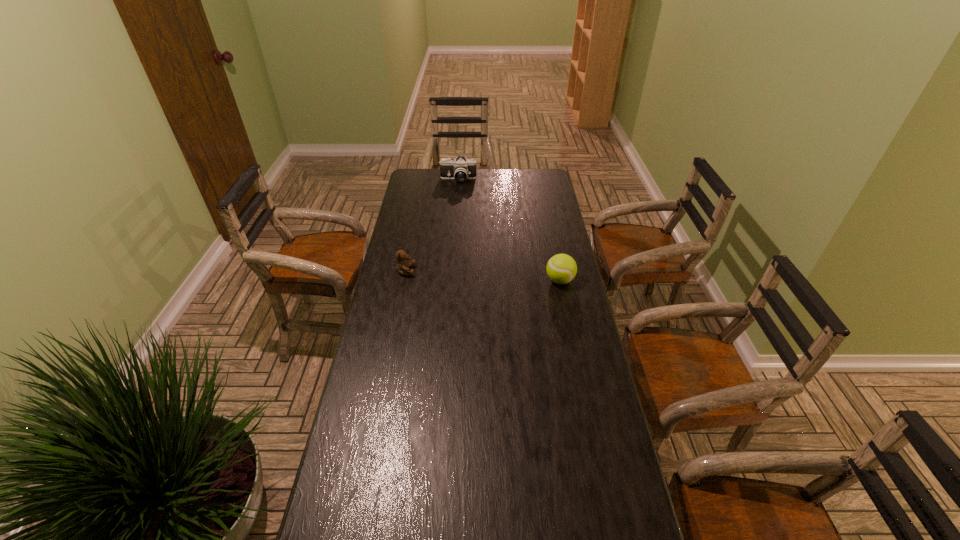
In order to click on blank space at the far edge of the desktop in this screenshot , I will do `click(477, 172)`.

In the image, there is a desktop. Where is `free region at the left edge`? free region at the left edge is located at coordinates (422, 236).

Where is `vacant region at the right edge of the desktop`? Image resolution: width=960 pixels, height=540 pixels. vacant region at the right edge of the desktop is located at coordinates (556, 238).

Where is `vacant space at the far right corner of the desktop`? vacant space at the far right corner of the desktop is located at coordinates (552, 181).

Where is `free space between the rightmost object and the farthest object`? free space between the rightmost object and the farthest object is located at coordinates (509, 230).

The width and height of the screenshot is (960, 540). I want to click on free space between the leftmost object and the camera, so click(x=432, y=225).

I want to click on vacant space that is in between the tennis ball and the leftmost object, so click(x=483, y=276).

Find the location of `object that is the nearest to the farthest object`. object that is the nearest to the farthest object is located at coordinates (403, 266).

Locate which object is the closest to the rightmost object. Please provide its 2D coordinates. Your answer should be formatted as a tuple, i.e. [(x, y)], where the tuple contains the x and y coordinates of a point satisfying the conditions above.

[(403, 266)]

Where is `vacant area in the image that satisfies the following two spatial constraints: 1. on the front-facing side of the leftmost object; 2. on the right side of the rightmost object`? vacant area in the image that satisfies the following two spatial constraints: 1. on the front-facing side of the leftmost object; 2. on the right side of the rightmost object is located at coordinates (404, 280).